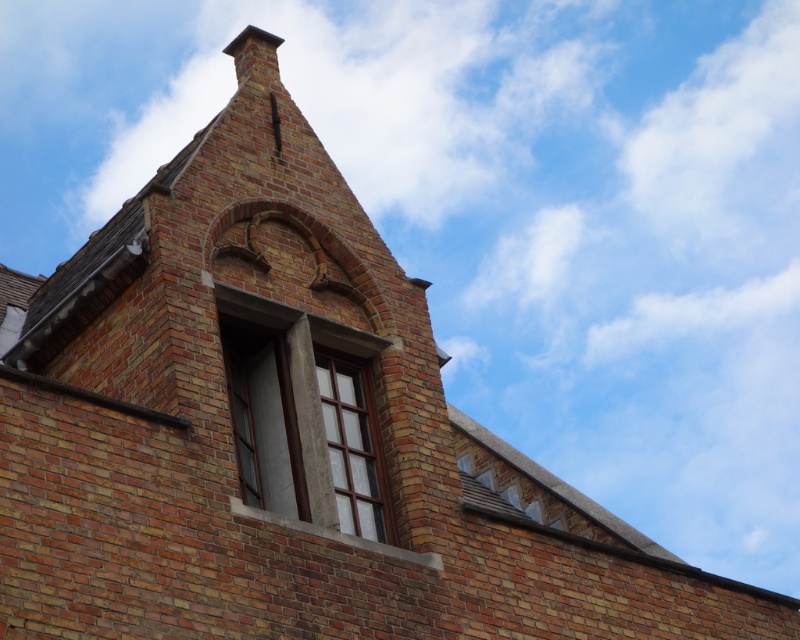
You are an architect analyzing the building facade. You notice a point at coordinates [264,419]. What object is located at this point?

The point at coordinates [264,419] is occupied by the matte gray stone window at center.

You are an architect designing a new building and want to ensure the matte glass window at center and the matte gray stone window at center fit within the designated space. Given that the designated space can only accommodate a window with a width of 1.2 meters, which of the two windows should you choose?

The matte glass window at center has a lesser width compared to the matte gray stone window at center. Therefore, the matte glass window at center should be chosen as it is narrower and will fit within the 1.2 meters width constraint.

You are standing in front of the brick building and notice two points marked on the facade. The first point is at coordinate point(238, 333) and the second is at point(341, 465). Which point is closer to you?

Point(341, 465) is closer to you because point(238, 333) is behind it.